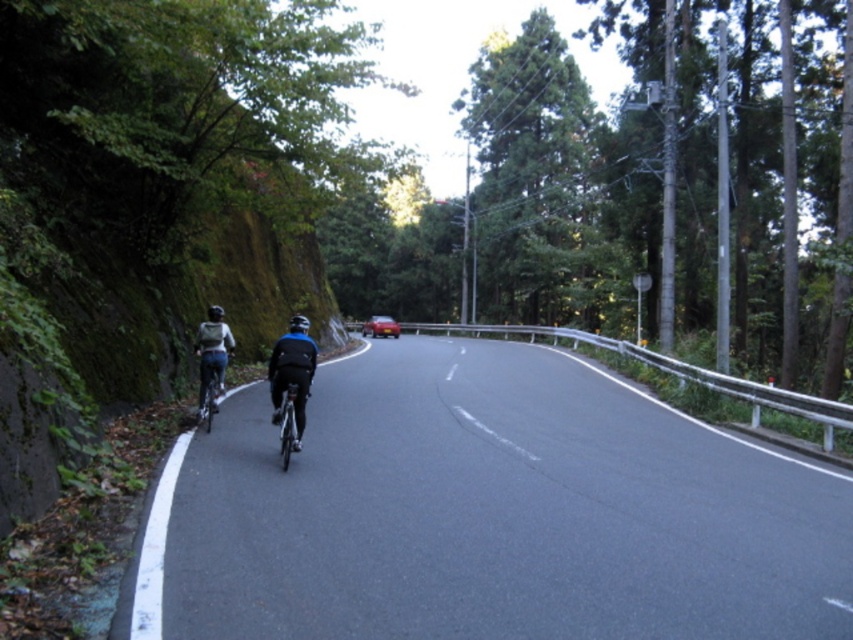
You are a hiker on the winding road and want to know which bicycle is closer to you. The shiny metallic bicycle at left and the shiny metallic bicycle at center are both on the road. Based on their sizes, which one is nearer?

The shiny metallic bicycle at left is larger in size than the shiny metallic bicycle at center, so it is closer to you since objects closer appear larger.

From the picture: You are a hiker standing at the starting point of the road. You see the black asphalt road at center and the blue fabric jacket at center. Which object is positioned to the right side of the other?

The black asphalt road at center is to the right of blue fabric jacket at center.

You are a hiker standing at the start of the road. You see a blue fabric jacket at center and a black matte bicycle helmet at upper center. Which object is closer to you?

The blue fabric jacket at center is closer to you since it is only 39.02 inches away from the black matte bicycle helmet at upper center, which is farther away.